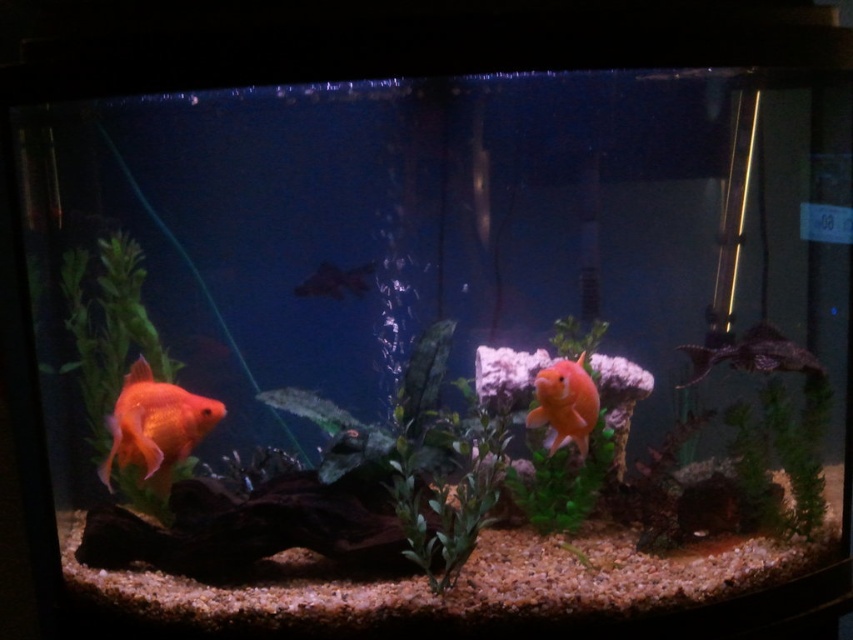
You are a small aquatic creature swimming in the fish tank. You see the green leafy plant at center and the matte black fish at center. Which object is bigger in size?

The green leafy plant at center is larger in size compared to the matte black fish at center.

You are a new fish in the tank and want to swim from the green leafy plant at left to the green leafy plant at right. Which direction should you swim?

The green leafy plant at left is positioned on the left side of green leafy plant at right, so you should swim to the right to reach the green leafy plant at right from the green leafy plant at left.

You are a goldfish in the fish tank. You want to swim from the left side to the center of the tank. Is the point at coordinate point (450,490) located on a green leafy plant at center?

Yes, the point at coordinate point (450,490) is located on the green leafy plant at center according to the description.